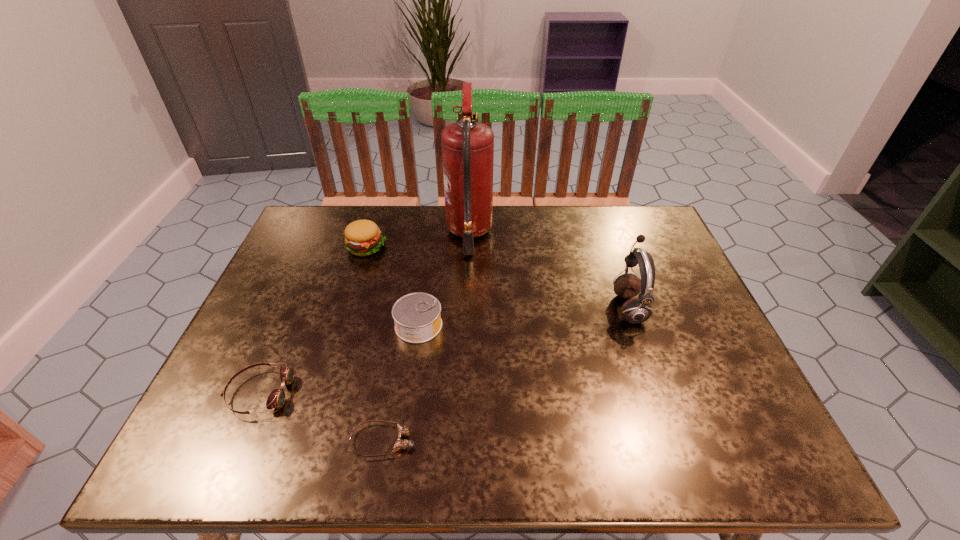
Where is `object that is at the near edge`? The width and height of the screenshot is (960, 540). object that is at the near edge is located at coordinates (400, 444).

Locate an element on the screen. Image resolution: width=960 pixels, height=540 pixels. object present at the left edge is located at coordinates (276, 399).

In order to click on object present at the right edge in this screenshot , I will do `click(636, 310)`.

In the image, there is a desktop. Find the location of `vacant space at the far edge`. vacant space at the far edge is located at coordinates coord(368,211).

Find the location of a particular element. The image size is (960, 540). free space at the near edge is located at coordinates (587, 428).

Identify the location of free region at the left edge. The image size is (960, 540). 295,329.

In the image, there is a desktop. In order to click on vacant space at the right edge in this screenshot , I will do `click(666, 301)`.

This screenshot has height=540, width=960. Find the location of `free space at the far left corner`. free space at the far left corner is located at coordinates [x=345, y=219].

This screenshot has width=960, height=540. What are the coordinates of `free space at the far right corner of the desktop` in the screenshot? It's located at (618, 219).

Where is `blank area at the near right corner`? The image size is (960, 540). blank area at the near right corner is located at coordinates (708, 448).